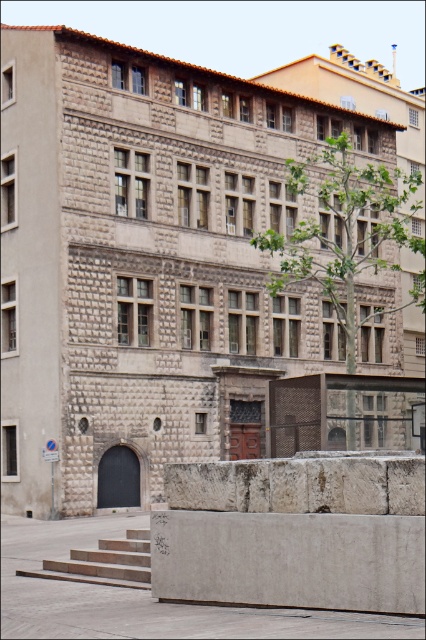
You are standing in front of the building and want to walk from point (359,172) to point (68,564). Which direction should you move relative to the building?

You should move towards the right and downward relative to the building because point (359,172) is further to the viewer than point (68,564), which is closer to the back of the building.

You are a window cleaner with a ladder that can reach up to 3 meters. You need to clean the windows of the building, but first, you must determine if your ladder is tall enough to reach the windows on the second floor. The green leafy tree at center and the concrete steps at lower left are in your way. Can you estimate whether your ladder is sufficient?

The green leafy tree at center is taller than the concrete steps at lower left. Since the tree is taller than the steps, but the exact height of the tree or the building windows isn

You are standing at the bottom of the concrete steps at lower left and want to reach the green leafy tree at center. Which direction should you move to get closer to the tree?

The green leafy tree at center is located above the concrete steps at lower left, so you should move upward to get closer to the tree.